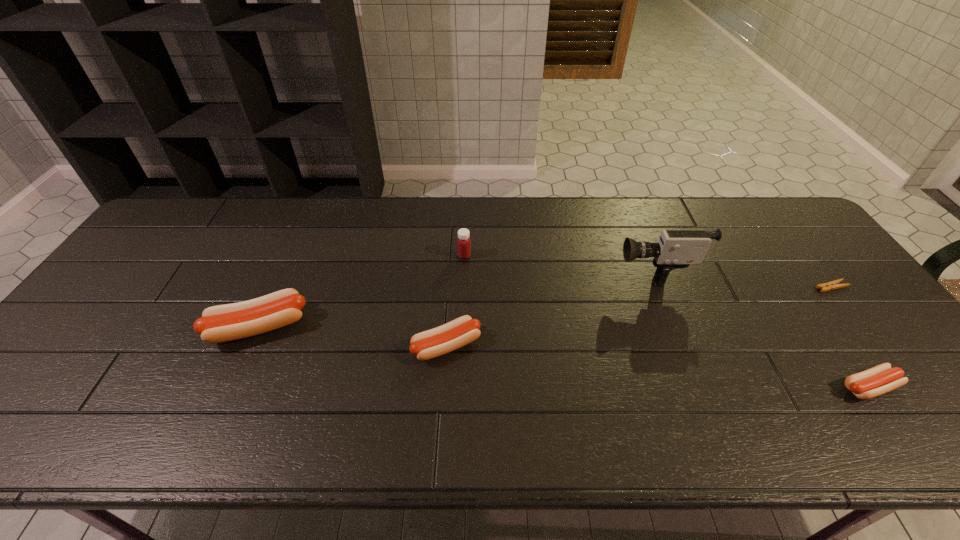
Where is `clothespin present at the right edge`? The width and height of the screenshot is (960, 540). clothespin present at the right edge is located at coordinates [832, 285].

Find the location of a particular element. The width and height of the screenshot is (960, 540). object at the near right corner is located at coordinates (880, 379).

Identify the location of vacant area at the far edge of the desktop. This screenshot has width=960, height=540. (484, 213).

In the image, there is a desktop. Where is `vacant space at the near edge`? This screenshot has height=540, width=960. vacant space at the near edge is located at coordinates (406, 375).

The height and width of the screenshot is (540, 960). I want to click on free region at the left edge of the desktop, so click(166, 266).

Identify the location of vacant space at the right edge. (816, 276).

I want to click on vacant area at the far left corner of the desktop, so click(x=197, y=233).

The width and height of the screenshot is (960, 540). I want to click on free space at the near right corner, so click(x=931, y=403).

Image resolution: width=960 pixels, height=540 pixels. I want to click on vacant point located between the medicine and the second sausage from left to right, so click(x=455, y=301).

Identify the location of unoccupied position between the tallest object and the shortest object. The width and height of the screenshot is (960, 540). (742, 278).